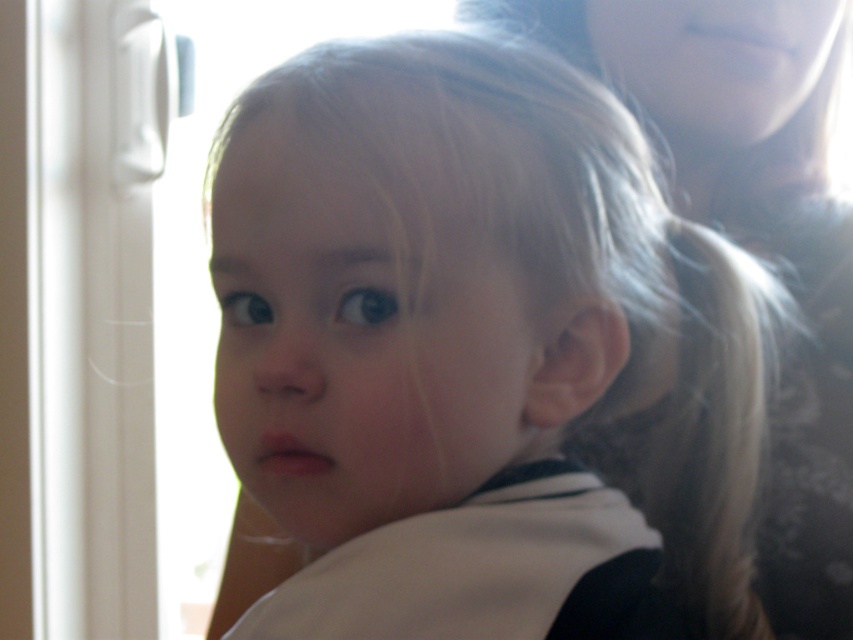
You are a photographer adjusting lighting for a portrait. You need to ensure that the smooth skin baby at center and the smooth skin face at upper center are both properly lit. Given their sizes, which one might require more fill light to avoid underexposure?

The smooth skin baby at center is thinner than the smooth skin face at upper center, so it might require more fill light to avoid underexposure because thinner objects may not reflect as much light and could appear darker in the image.

You are a photographer trying to capture a clear shot of the smooth skin baby at center and the smooth skin face at upper center. Which subject should you focus on to ensure the baby is in sharp focus?

The smooth skin baby at center is in front of the smooth skin face at upper center, so focusing on the smooth skin baby at center will ensure it is in sharp focus.